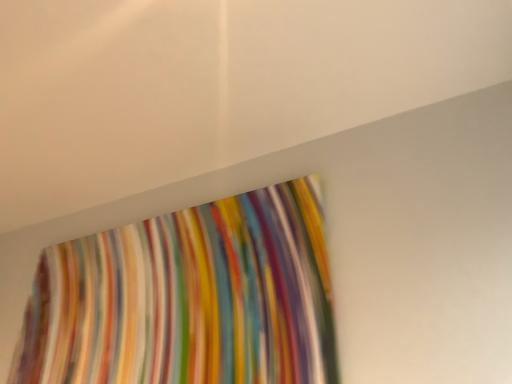
What do you see at coordinates (188, 298) in the screenshot?
I see `multicolored striped fabric at center` at bounding box center [188, 298].

Find the location of `multicolored striped fabric at center`. multicolored striped fabric at center is located at coordinates (188, 298).

Locate an element on the screen. The width and height of the screenshot is (512, 384). multicolored striped fabric at center is located at coordinates (188, 298).